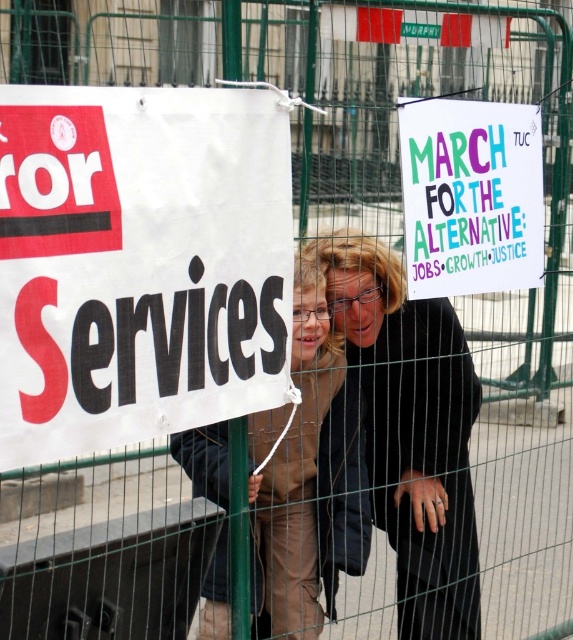
Question: Which of the following is the farthest from the observer?

Choices:
 (A) multicolored paper sign at upper right
 (B) brown fabric coat at center

Answer: (A)

Question: Is brown fabric coat at center below multicolored paper sign at upper right?

Choices:
 (A) yes
 (B) no

Answer: (A)

Question: Which is farther from the brown fabric coat at center?

Choices:
 (A) black fabric coat at center
 (B) multicolored paper sign at upper right

Answer: (B)

Question: Does white paper sign at left appear under brown fabric coat at center?

Choices:
 (A) no
 (B) yes

Answer: (A)

Question: Which object is closer to the camera taking this photo?

Choices:
 (A) white paper sign at left
 (B) multicolored paper sign at upper right
 (C) brown fabric coat at center

Answer: (A)

Question: Does white paper sign at left appear over brown fabric coat at center?

Choices:
 (A) no
 (B) yes

Answer: (B)